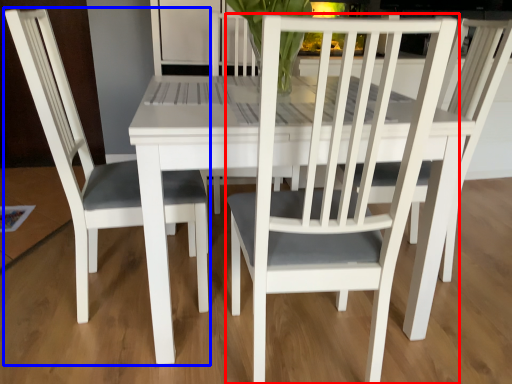
Question: Among these objects, which one is nearest to the camera, chair (highlighted by a red box) or chair (highlighted by a blue box)?

Choices:
 (A) chair
 (B) chair

Answer: (A)